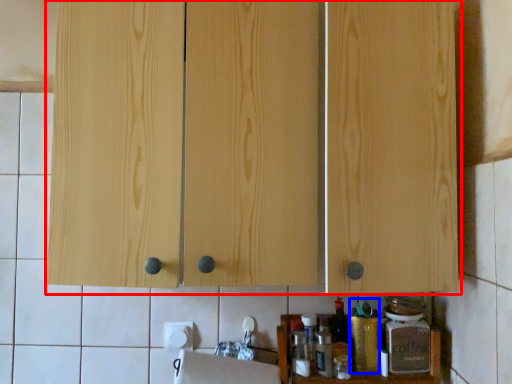
Question: Which object is closer to the camera taking this photo, cabinetry (highlighted by a red box) or bottle (highlighted by a blue box)?

Choices:
 (A) cabinetry
 (B) bottle

Answer: (A)